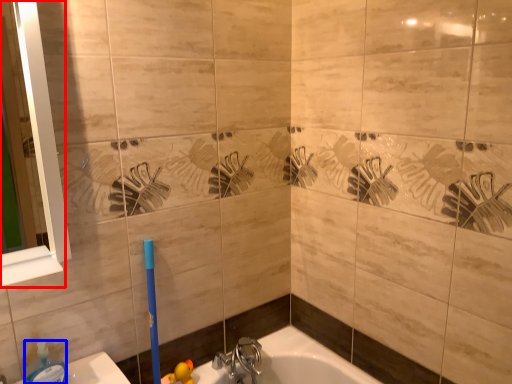
Question: Which object is closer to the camera taking this photo, mirror (highlighted by a red box) or soap dispenser (highlighted by a blue box)?

Choices:
 (A) mirror
 (B) soap dispenser

Answer: (A)